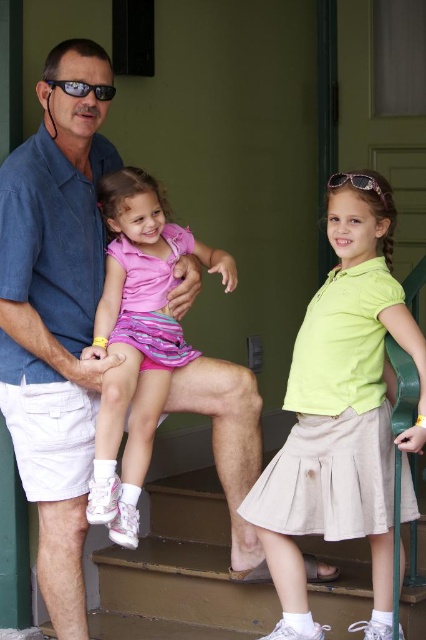
Question: Does lime green polo shirt at center come behind black plastic sunglasses at upper left?

Choices:
 (A) yes
 (B) no

Answer: (B)

Question: Considering the real-world distances, which object is closest to the matte blue shirt at center?

Choices:
 (A) pink striped skirt at center
 (B) lime green polo shirt at center

Answer: (A)

Question: Does matte blue shirt at center appear on the right side of lime green polo shirt at center?

Choices:
 (A) no
 (B) yes

Answer: (A)

Question: Which point is farther to the camera?

Choices:
 (A) lime green polo shirt at center
 (B) pink striped skirt at center

Answer: (B)

Question: Estimate the real-world distances between objects in this image. Which object is closer to the black plastic sunglasses at upper left?

Choices:
 (A) pink striped skirt at center
 (B) matte blue shirt at center
 (C) lime green polo shirt at center

Answer: (B)

Question: Can you confirm if matte blue shirt at center is positioned below lime green polo shirt at center?

Choices:
 (A) no
 (B) yes

Answer: (A)